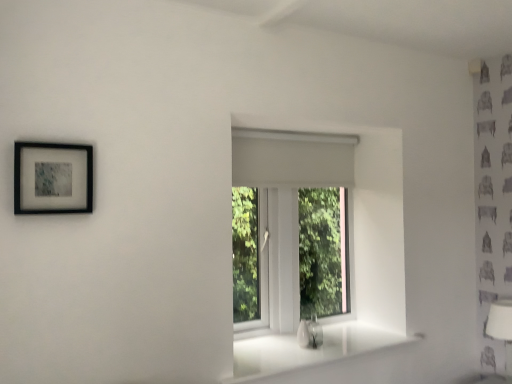
Question: From the image's perspective, is white fabric lampshade at lower right located beneath white matte window at center?

Choices:
 (A) yes
 (B) no

Answer: (A)

Question: Can you confirm if white fabric lampshade at lower right is positioned to the right of white matte window at center?

Choices:
 (A) no
 (B) yes

Answer: (B)

Question: Is white fabric lampshade at lower right further to the viewer compared to white matte window at center?

Choices:
 (A) no
 (B) yes

Answer: (A)

Question: Is white fabric lampshade at lower right bigger than white matte window at center?

Choices:
 (A) yes
 (B) no

Answer: (B)

Question: Is white fabric lampshade at lower right smaller than white matte window at center?

Choices:
 (A) no
 (B) yes

Answer: (B)

Question: Would you say white fabric lampshade at lower right is outside white matte window at center?

Choices:
 (A) yes
 (B) no

Answer: (A)

Question: From the image's perspective, is white matte window at center below white glossy window sill at center?

Choices:
 (A) no
 (B) yes

Answer: (A)

Question: From a real-world perspective, is white matte window at center on white glossy window sill at center?

Choices:
 (A) yes
 (B) no

Answer: (A)

Question: From a real-world perspective, is white matte window at center under white glossy window sill at center?

Choices:
 (A) no
 (B) yes

Answer: (A)

Question: Can you confirm if white matte window at center is shorter than white glossy window sill at center?

Choices:
 (A) no
 (B) yes

Answer: (A)

Question: Is white matte window at center not near white glossy window sill at center?

Choices:
 (A) yes
 (B) no

Answer: (B)

Question: Considering the relative positions of white matte window at center and white glossy window sill at center in the image provided, is white matte window at center to the left of white glossy window sill at center from the viewer's perspective?

Choices:
 (A) no
 (B) yes

Answer: (B)

Question: Is white matte window at center thinner than black matte picture frame at upper left?

Choices:
 (A) no
 (B) yes

Answer: (A)